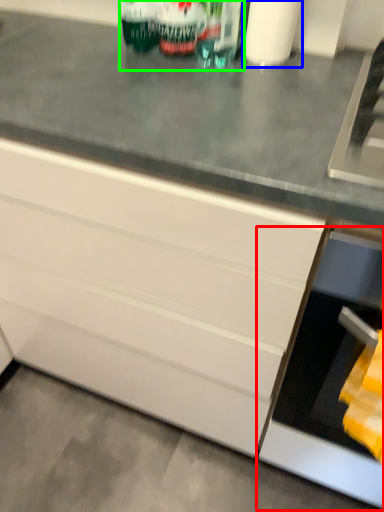
Question: Which is farther away from oven (highlighted by a red box)? toilet paper (highlighted by a blue box) or beverage (highlighted by a green box)?

Choices:
 (A) toilet paper
 (B) beverage

Answer: (A)